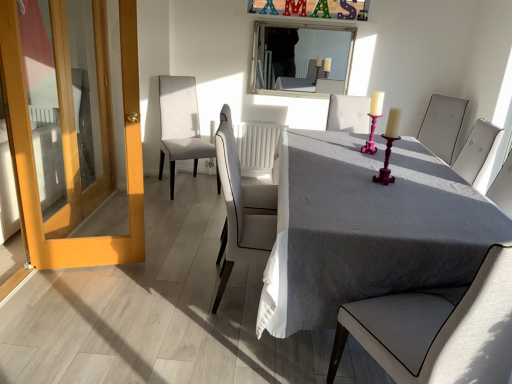
At what (x,y) coordinates should I click in order to perform the action: click on free space in front of wooden door at left. Please return your answer as a coordinate pair (x, y). The width and height of the screenshot is (512, 384). Looking at the image, I should click on (38, 307).